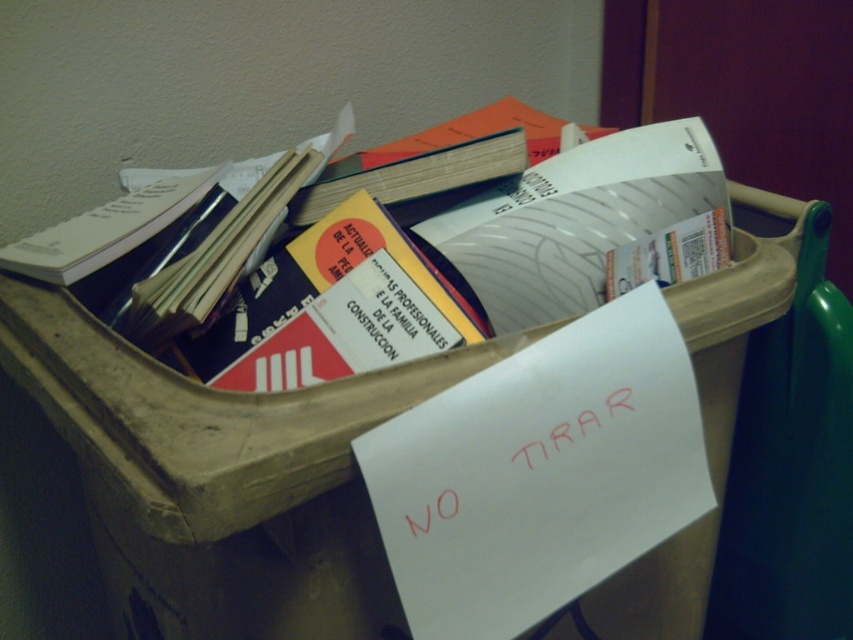
Does white glossy paper at center appear on the right side of hardcover book at center?

Correct, you'll find white glossy paper at center to the right of hardcover book at center.

Which is more to the right, white glossy paper at center or hardcover book at center?

white glossy paper at center

Measure the distance between white glossy paper at center and camera.

26.19 inches

Locate an element on the screen. The width and height of the screenshot is (853, 640). white glossy paper at center is located at coordinates (572, 221).

Who is lower down, white glossy paper at center or white paper book at upper left?

white glossy paper at center

Does point (502, 276) come farther from viewer compared to point (119, 236)?

Yes.

You are a GUI agent. You are given a task and a screenshot of the screen. Output one action in this format:
    pyautogui.click(x=<x>, y=<y>)
    Task: Click on the white glossy paper at center
    The height and width of the screenshot is (640, 853).
    Given the screenshot: What is the action you would take?
    pyautogui.click(x=572, y=221)

Who is lower down, white paper book at upper left or hardcover book at center?

Positioned lower is white paper book at upper left.

Which is behind, point (136, 192) or point (456, 156)?

Positioned behind is point (136, 192).

Where is `white paper book at upper left`? This screenshot has height=640, width=853. white paper book at upper left is located at coordinates (106, 228).